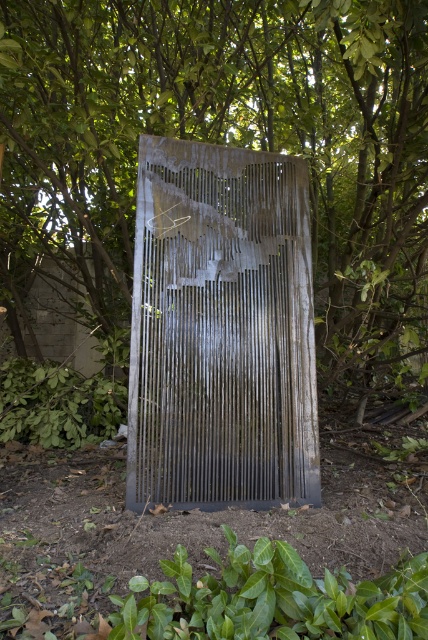
Question: Which point is closer to the camera?

Choices:
 (A) (371, 602)
 (B) (288, 260)
 (C) (2, 67)

Answer: (A)

Question: Can you confirm if rusty metal sculpture at center is smaller than rusty metal screen door at center?

Choices:
 (A) no
 (B) yes

Answer: (A)

Question: Does rusty metal sculpture at center appear under green leafy plant at lower center?

Choices:
 (A) no
 (B) yes

Answer: (A)

Question: Which of the following is the closest to the observer?

Choices:
 (A) (231, 584)
 (B) (47, 58)

Answer: (A)

Question: Does rusty metal screen door at center come in front of green leafy plant at lower center?

Choices:
 (A) no
 (B) yes

Answer: (A)

Question: Which object is the closest to the rusty metal sculpture at center?

Choices:
 (A) rusty metal screen door at center
 (B) green leafy plant at lower center

Answer: (A)